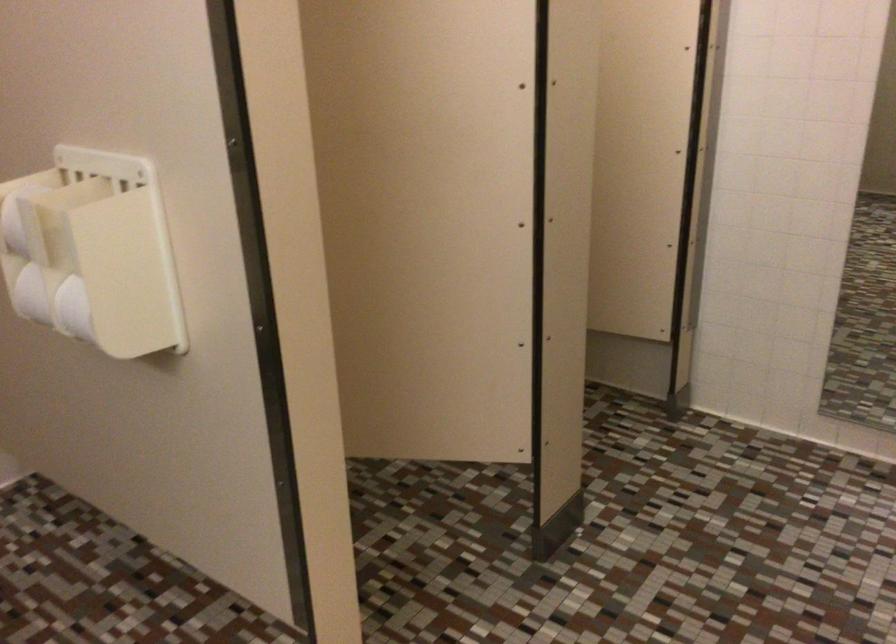
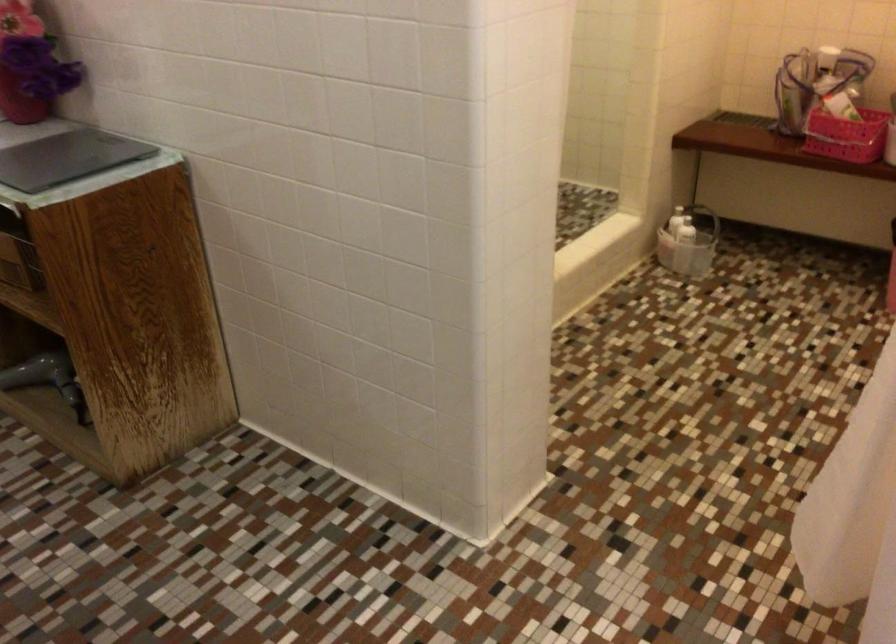
The first image is from the beginning of the video and the second image is from the end. How did the camera likely rotate when shooting the video?

The camera's rotation is toward right-down.